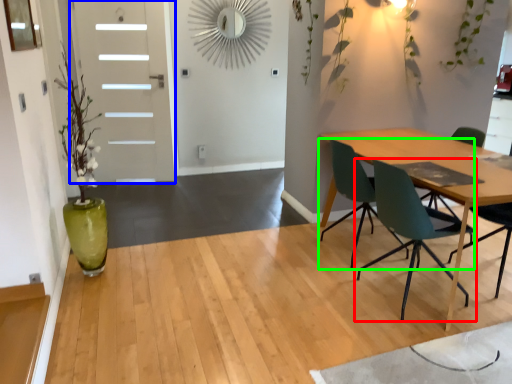
Question: Which object is the closest to the chair (highlighted by a red box)? Choose among these: door (highlighted by a blue box) or chair (highlighted by a green box).

Choices:
 (A) door
 (B) chair

Answer: (B)